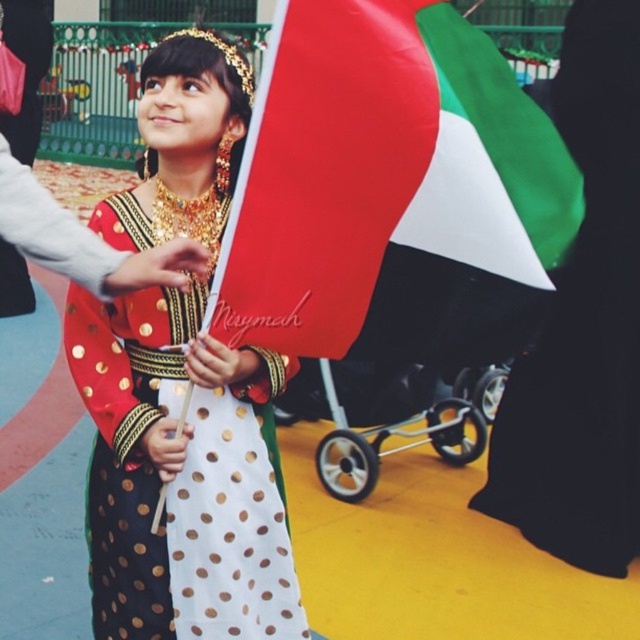
You are a photographer at the event. You want to take a photo of the polka dot dress at center without the polyester flag at center blocking it. What should you do?

Move the polyester flag at center behind the polka dot dress at center so it is no longer in front of it.

You are taking a photo of the scene and want to focus on both point (346,116) and point (504,417). Which point should you adjust your focus to first to ensure both are in clear view?

Point (346,116) is closer to the camera than point (504,417). To ensure both are in clear view, focus on the closer point first, which is point (346,116).

You are standing at the origin point in the image. Where is the polyester flag at center located in terms of coordinates?

The polyester flag at center is located at coordinates point (392, 192).